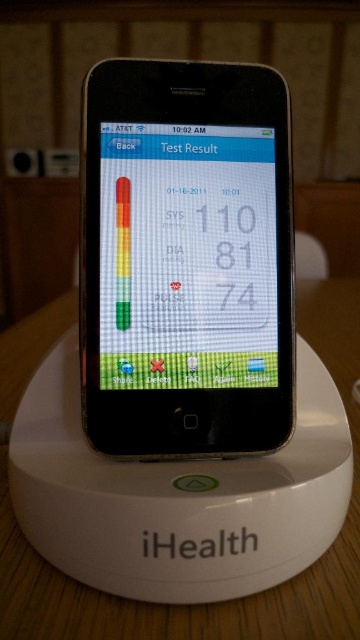
Question: Is matte plastic screen at center above white matte table at center?

Choices:
 (A) no
 (B) yes

Answer: (B)

Question: From the image, what is the correct spatial relationship of matte plastic screen at center in relation to white matte table at center?

Choices:
 (A) left
 (B) right

Answer: (B)

Question: Among these objects, which one is nearest to the camera?

Choices:
 (A) white matte table at center
 (B) matte plastic screen at center

Answer: (A)

Question: Is matte plastic screen at center above white matte table at center?

Choices:
 (A) yes
 (B) no

Answer: (A)

Question: Which point appears farthest from the camera in this image?

Choices:
 (A) (110, 234)
 (B) (6, 490)

Answer: (B)